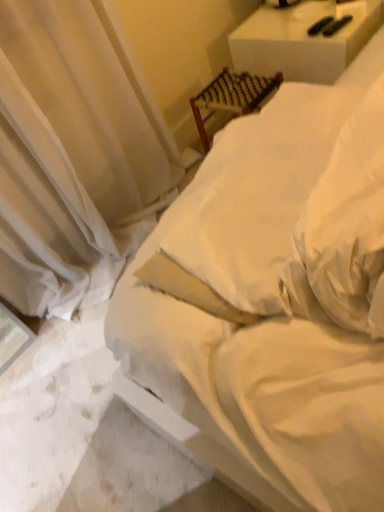
Question: Should I look upward or downward to see white woven chair at upper right, the 2th furniture from the left?

Choices:
 (A) down
 (B) up

Answer: (B)

Question: Is woven wood chair at upper center, which ranks as the first furniture in left-to-right order, bigger than white soft bed at center?

Choices:
 (A) yes
 (B) no

Answer: (B)

Question: From a real-world perspective, is woven wood chair at upper center, which ranks as the first furniture in left-to-right order, beneath white soft bed at center?

Choices:
 (A) no
 (B) yes

Answer: (B)

Question: Is woven wood chair at upper center, which ranks as the first furniture in left-to-right order, positioned far away from white soft bed at center?

Choices:
 (A) yes
 (B) no

Answer: (B)

Question: From a real-world perspective, is woven wood chair at upper center, which ranks as the first furniture in left-to-right order, on top of white soft bed at center?

Choices:
 (A) yes
 (B) no

Answer: (B)

Question: From the image's perspective, is woven wood chair at upper center, which ranks as the first furniture in left-to-right order, below white soft bed at center?

Choices:
 (A) no
 (B) yes

Answer: (A)

Question: Can you confirm if woven wood chair at upper center, which ranks as the first furniture in left-to-right order, is thinner than white soft bed at center?

Choices:
 (A) yes
 (B) no

Answer: (A)

Question: Is white sheer curtain at upper left to the right of woven wood chair at upper center, marked as the second furniture in a right-to-left arrangement, from the viewer's perspective?

Choices:
 (A) yes
 (B) no

Answer: (B)

Question: Is white sheer curtain at upper left turned away from woven wood chair at upper center, marked as the second furniture in a right-to-left arrangement?

Choices:
 (A) no
 (B) yes

Answer: (A)

Question: Can you confirm if white sheer curtain at upper left is shorter than woven wood chair at upper center, marked as the second furniture in a right-to-left arrangement?

Choices:
 (A) yes
 (B) no

Answer: (B)

Question: Can you confirm if white sheer curtain at upper left is thinner than woven wood chair at upper center, which ranks as the first furniture in left-to-right order?

Choices:
 (A) yes
 (B) no

Answer: (B)

Question: Is the surface of white sheer curtain at upper left in direct contact with woven wood chair at upper center, which ranks as the first furniture in left-to-right order?

Choices:
 (A) yes
 (B) no

Answer: (B)

Question: Is white sheer curtain at upper left behind woven wood chair at upper center, which ranks as the first furniture in left-to-right order?

Choices:
 (A) yes
 (B) no

Answer: (B)

Question: Does white woven chair at upper right, the 2th furniture from the left, lie in front of white sheer curtain at upper left?

Choices:
 (A) yes
 (B) no

Answer: (B)